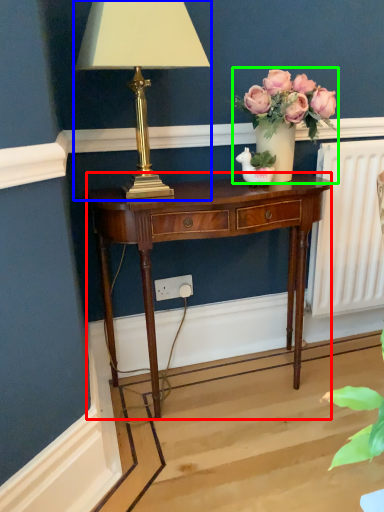
Question: Considering the real-world distances, which object is farthest from nightstand (highlighted by a red box)? lamp (highlighted by a blue box) or houseplant (highlighted by a green box)?

Choices:
 (A) lamp
 (B) houseplant

Answer: (A)